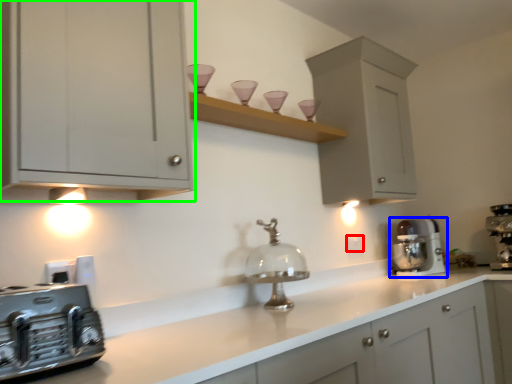
Question: Which object is positioned farthest from electric outlet (highlighted by a red box)? Select from home appliance (highlighted by a blue box) and cabinetry (highlighted by a green box).

Choices:
 (A) home appliance
 (B) cabinetry

Answer: (B)